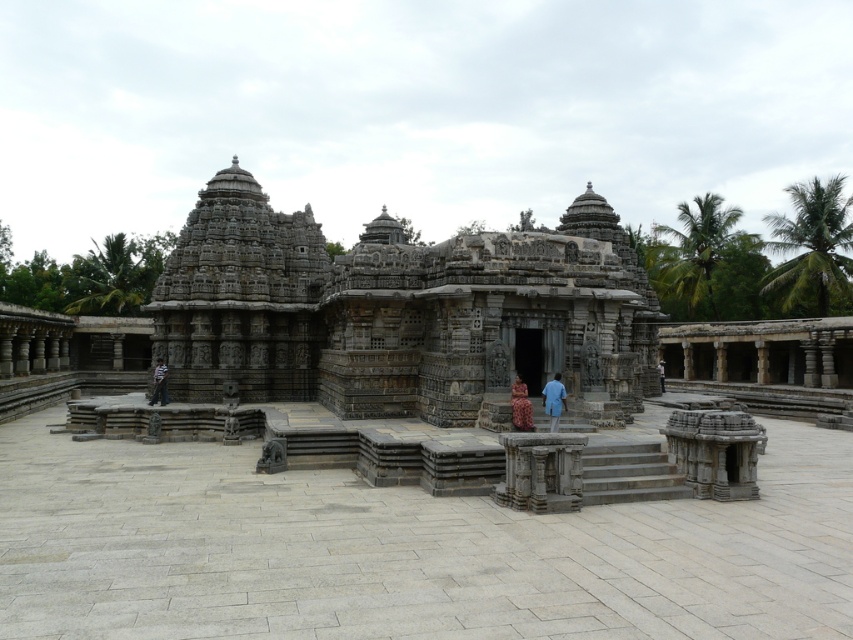
You are a photographer standing in the temple complex and want to take a photo of the blue cotton shirt at center and the light blue fabric at center. Which object should you focus on first to ensure both are in sharp focus?

The blue cotton shirt at center is in front of the light blue fabric at center. To ensure both are in sharp focus, you should focus on the blue cotton shirt at center first since it is closer to the camera.

Consider the image. You are a visitor at the temple complex and want to take a photo of the gray stone hindu temple at center and the matte brown dress at center. Which object should you focus on first if you want to capture both in a single frame without moving the camera?

You should focus on the gray stone hindu temple at center first because it is positioned over the matte brown dress at center, meaning it is closer to the camera. By focusing on the closer object, the temple, the dress behind it may still be in acceptable focus depending on the depth of field.